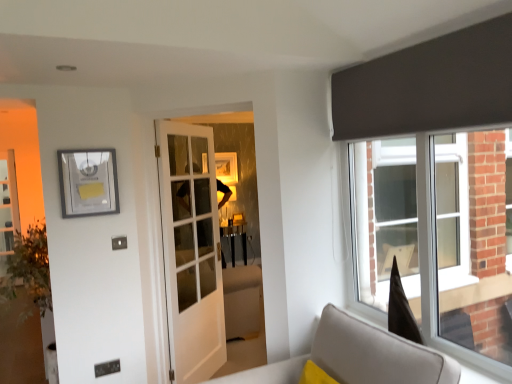
Question: Are matte silver picture frame at upper left and light gray fabric sofa at lower right far apart?

Choices:
 (A) no
 (B) yes

Answer: (B)

Question: Does matte silver picture frame at upper left have a lesser height compared to light gray fabric sofa at lower right?

Choices:
 (A) no
 (B) yes

Answer: (B)

Question: Considering the relative sizes of matte silver picture frame at upper left and light gray fabric sofa at lower right in the image provided, is matte silver picture frame at upper left bigger than light gray fabric sofa at lower right?

Choices:
 (A) yes
 (B) no

Answer: (B)

Question: Is the position of matte silver picture frame at upper left less distant than that of light gray fabric sofa at lower right?

Choices:
 (A) yes
 (B) no

Answer: (B)

Question: Does matte silver picture frame at upper left appear on the left side of light gray fabric sofa at lower right?

Choices:
 (A) no
 (B) yes

Answer: (B)

Question: Does matte silver picture frame at upper left appear on the right side of light gray fabric sofa at lower right?

Choices:
 (A) no
 (B) yes

Answer: (A)

Question: Does light gray fabric sofa at lower right have a greater width compared to white glass door at center?

Choices:
 (A) yes
 (B) no

Answer: (A)

Question: Is white glass door at center surrounded by light gray fabric sofa at lower right?

Choices:
 (A) no
 (B) yes

Answer: (A)

Question: From a real-world perspective, is light gray fabric sofa at lower right located beneath white glass door at center?

Choices:
 (A) no
 (B) yes

Answer: (B)

Question: Would you say light gray fabric sofa at lower right is outside white glass door at center?

Choices:
 (A) no
 (B) yes

Answer: (B)

Question: From a real-world perspective, is light gray fabric sofa at lower right on top of white glass door at center?

Choices:
 (A) yes
 (B) no

Answer: (B)

Question: Can you confirm if light gray fabric sofa at lower right is positioned to the right of white glass door at center?

Choices:
 (A) no
 (B) yes

Answer: (B)

Question: Is white glass door at center completely or partially outside of light gray fabric sofa at lower right?

Choices:
 (A) yes
 (B) no

Answer: (A)